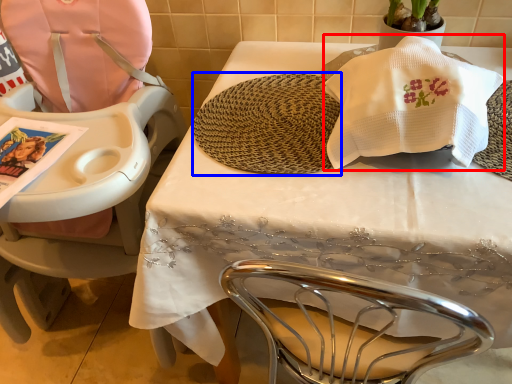
Question: Which object appears farthest to the camera in this image, blanket (highlighted by a red box) or mat (highlighted by a blue box)?

Choices:
 (A) blanket
 (B) mat

Answer: (B)